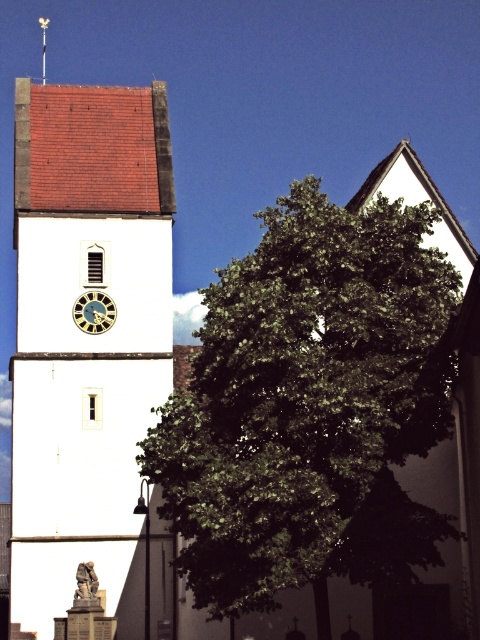
Question: Among these points, which one is nearest to the camera?

Choices:
 (A) (43, 83)
 (B) (103, 330)
 (C) (203, 532)
 (D) (109, 179)

Answer: (C)

Question: Which object is the closest to the green leafy tree at center?

Choices:
 (A) metallic spire at upper center
 (B) gold metallic clock at center
 (C) white smooth tower at center

Answer: (C)

Question: From the image, what is the correct spatial relationship of gold metallic clock at center in relation to metallic spire at upper center?

Choices:
 (A) above
 (B) below

Answer: (B)

Question: Observing the image, what is the correct spatial positioning of white smooth tower at center in reference to gold metallic clock at center?

Choices:
 (A) left
 (B) right

Answer: (A)

Question: Which of these objects is positioned farthest from the gold metallic clock at center?

Choices:
 (A) green leafy tree at center
 (B) white smooth tower at center
 (C) metallic spire at upper center

Answer: (C)

Question: Is gold metallic clock at center closer to camera compared to metallic spire at upper center?

Choices:
 (A) no
 (B) yes

Answer: (B)